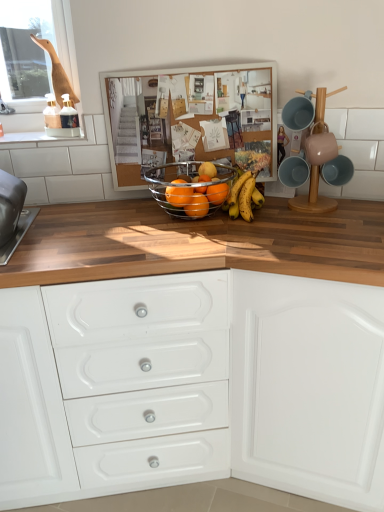
Question: From the image's perspective, does glossy orange at center, which is the fourth orange in left-to-right order, appear higher than glossy metallic fruit basket at center, acting as the fourth orange starting from the right?

Choices:
 (A) yes
 (B) no

Answer: (A)

Question: Can you see glossy orange at center, which is the first orange from right to left, touching glossy metallic fruit basket at center, acting as the fourth orange starting from the right?

Choices:
 (A) yes
 (B) no

Answer: (B)

Question: Is glossy orange at center, which is the first orange from right to left, positioned in front of glossy metallic fruit basket at center, acting as the fourth orange starting from the right?

Choices:
 (A) yes
 (B) no

Answer: (B)

Question: Does glossy orange at center, which is the first orange from right to left, have a lesser height compared to glossy metallic fruit basket at center, marked as the 1th orange in a left-to-right arrangement?

Choices:
 (A) yes
 (B) no

Answer: (B)

Question: Is glossy orange at center, which is the fourth orange in left-to-right order, positioned with its back to glossy metallic fruit basket at center, acting as the fourth orange starting from the right?

Choices:
 (A) yes
 (B) no

Answer: (B)

Question: In terms of size, does white glossy chest of drawers at center appear bigger or smaller than white matte cabinet at center?

Choices:
 (A) big
 (B) small

Answer: (A)

Question: From a real-world perspective, is white glossy chest of drawers at center physically located above or below white matte cabinet at center?

Choices:
 (A) above
 (B) below

Answer: (B)

Question: From their relative heights in the image, would you say white glossy chest of drawers at center is taller or shorter than white matte cabinet at center?

Choices:
 (A) short
 (B) tall

Answer: (B)

Question: Looking at their shapes, would you say white glossy chest of drawers at center is wider or thinner than white matte cabinet at center?

Choices:
 (A) wide
 (B) thin

Answer: (A)

Question: Is orange matte at center in front of or behind yellow matte bananas at center in the image?

Choices:
 (A) front
 (B) behind

Answer: (B)

Question: Is point (206, 166) closer or farther from the camera than point (238, 185)?

Choices:
 (A) farther
 (B) closer

Answer: (A)

Question: Considering the relative positions of orange matte at center and yellow matte bananas at center in the image provided, is orange matte at center to the left or to the right of yellow matte bananas at center?

Choices:
 (A) right
 (B) left

Answer: (B)

Question: From their relative heights in the image, would you say orange matte at center is taller or shorter than yellow matte bananas at center?

Choices:
 (A) short
 (B) tall

Answer: (A)

Question: From a real-world perspective, is orange matte at center physically located above or below white matte cabinet at center?

Choices:
 (A) below
 (B) above

Answer: (B)

Question: In the image, is orange matte at center on the left side or the right side of white matte cabinet at center?

Choices:
 (A) right
 (B) left

Answer: (B)